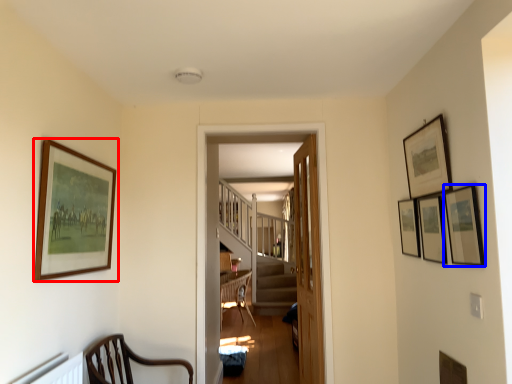
Question: Which object is closer to the camera taking this photo, picture frame (highlighted by a red box) or picture frame (highlighted by a blue box)?

Choices:
 (A) picture frame
 (B) picture frame

Answer: (B)